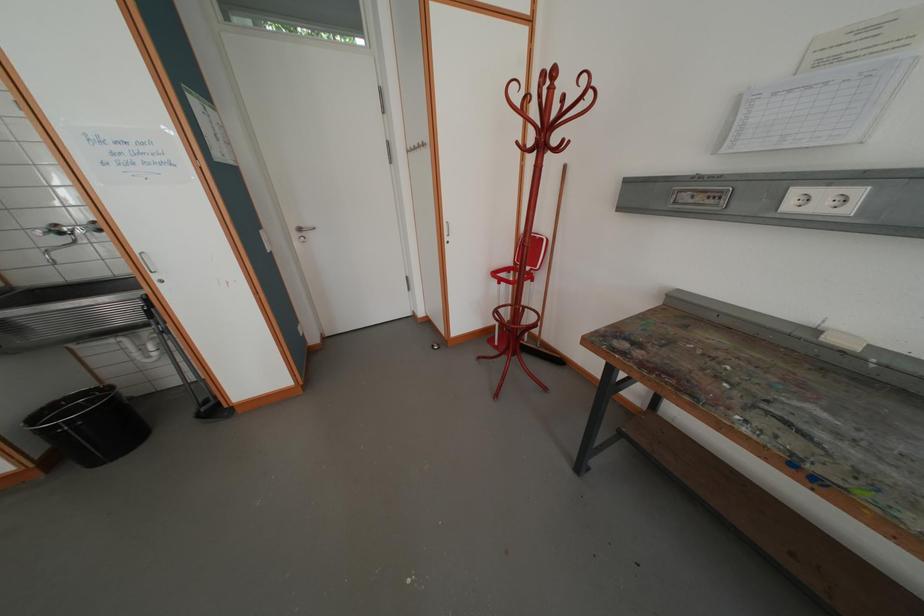
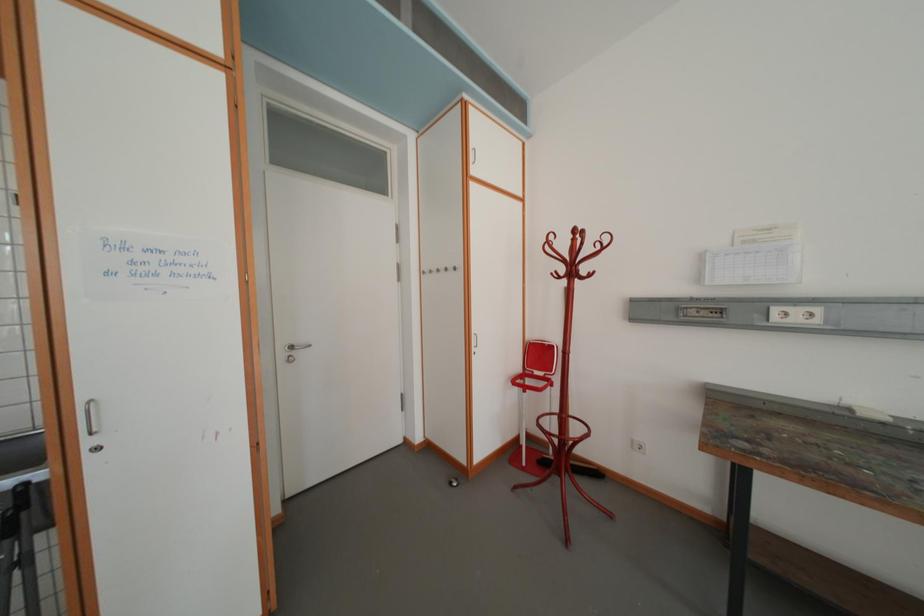
Question: Which direction would the cameraman need to move to produce the second image? Reply with the corresponding letter.

Choices:
 (A) Left
 (B) Right
 (C) Forward
 (D) Backward

Answer: (A)